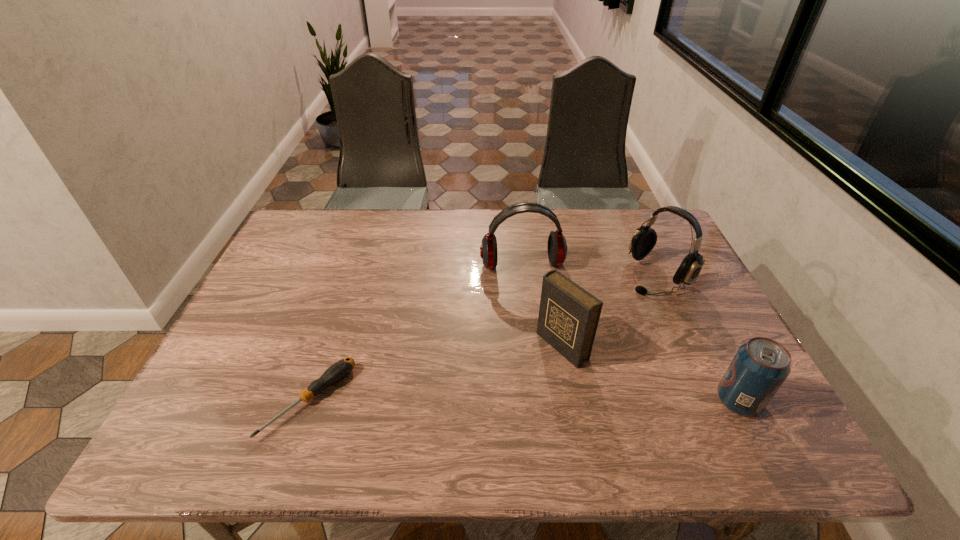
Where is `vacant space located on the ear cups of the earphone`? The height and width of the screenshot is (540, 960). vacant space located on the ear cups of the earphone is located at coordinates (542, 347).

Find the location of `free location located with the microphone on the side of the headset`. free location located with the microphone on the side of the headset is located at coordinates (568, 334).

At what (x,y) coordinates should I click in order to perform the action: click on vacant region located with the microphone on the side of the headset. Please return your answer as a coordinate pair (x, y). This screenshot has height=540, width=960. Looking at the image, I should click on click(574, 331).

Find the location of a particular element. blank area located 0.200m with the microphone on the side of the headset is located at coordinates (590, 320).

I want to click on free region located 0.200m on the front cover of the diary, so click(478, 406).

Locate an element on the screen. free space located 0.140m on the front cover of the diary is located at coordinates 499,391.

In order to click on vacant region located on the front cover of the diary in this screenshot , I will do `click(470, 410)`.

Identify the location of object present at the far edge. This screenshot has width=960, height=540. (557, 248).

Identify the location of screwdriver that is at the near edge. The image size is (960, 540). (339, 370).

At what (x,y) coordinates should I click in order to perform the action: click on pop soda at the near edge. Please return your answer as a coordinate pair (x, y). Looking at the image, I should click on (759, 368).